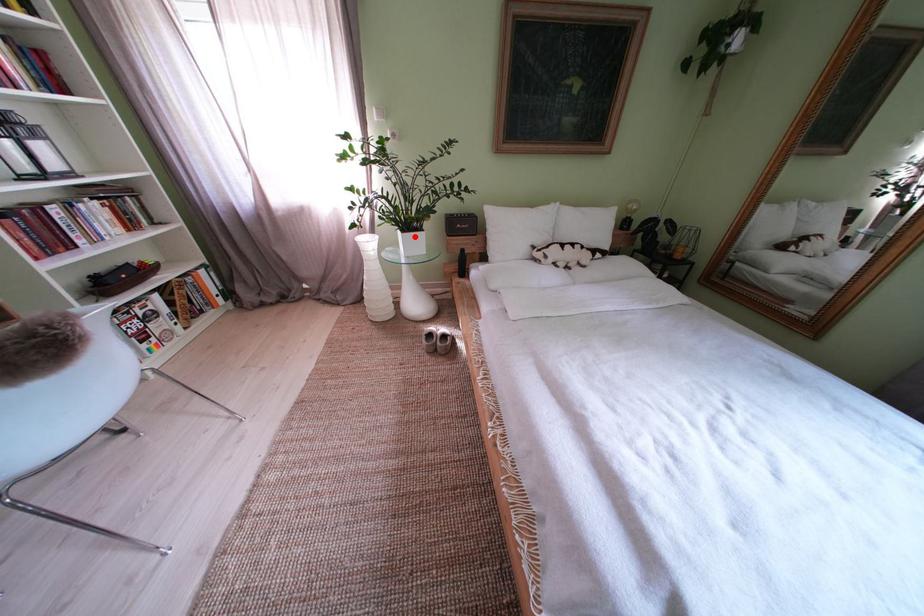
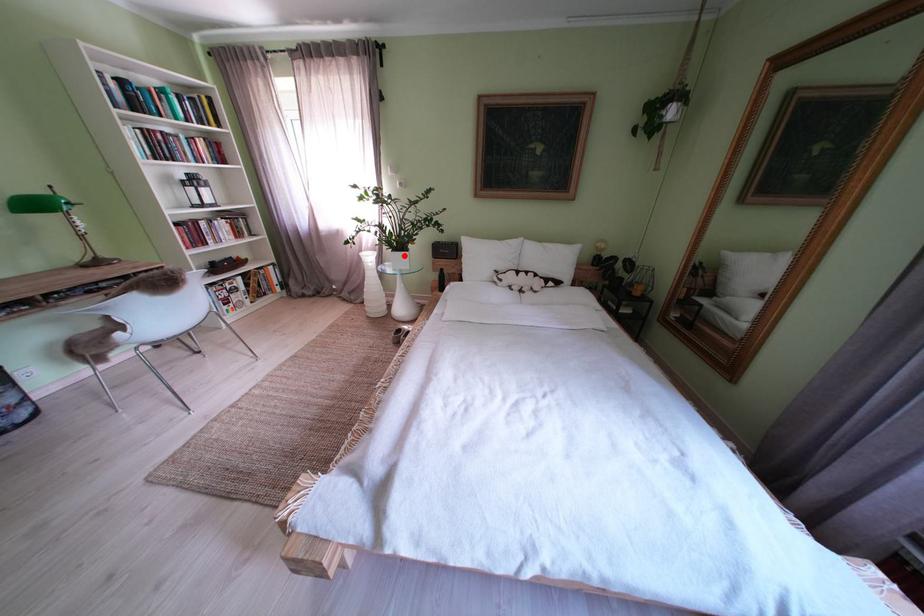
I am providing you with two images of the same scene from different viewpoints. A red point is marked on the first image and another point is marked on the second image. Are the points marked in image1 and image2 representing the same 3D position?

Yes